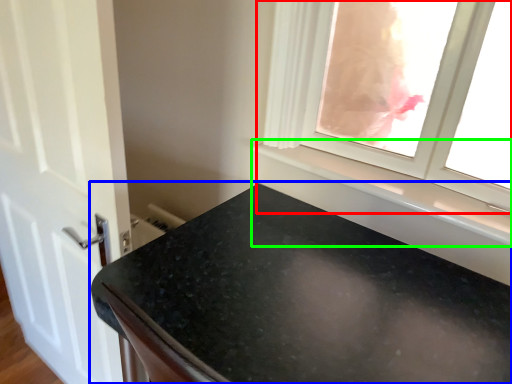
Question: Based on their relative distances, which object is nearer to window (highlighted by a red box)? Choose from countertop (highlighted by a blue box) and window sill (highlighted by a green box).

Choices:
 (A) countertop
 (B) window sill

Answer: (B)